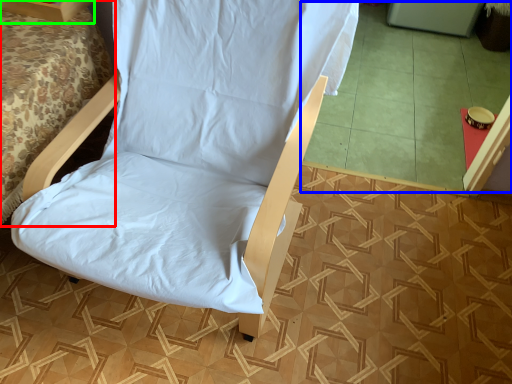
Question: Which object is the closest to the bed (highlighted by a red box)? Choose among these: tile (highlighted by a blue box) or furniture (highlighted by a green box).

Choices:
 (A) tile
 (B) furniture

Answer: (B)